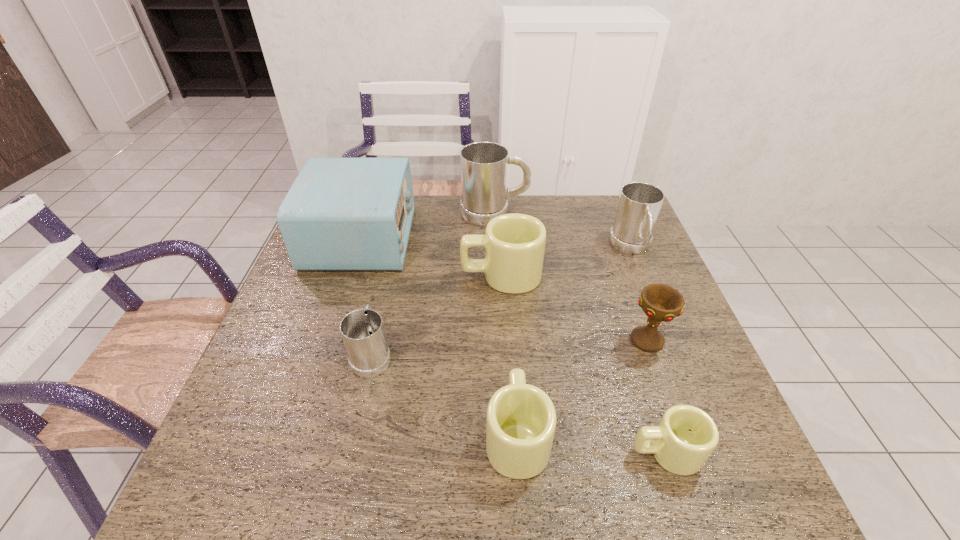
Where is `blank space that satisfies the following two spatial constraints: 1. with the handle on the side of the second biggest beige mug; 2. with the handle on the side of the farthest beige mug`? The height and width of the screenshot is (540, 960). blank space that satisfies the following two spatial constraints: 1. with the handle on the side of the second biggest beige mug; 2. with the handle on the side of the farthest beige mug is located at coordinates (506, 275).

The height and width of the screenshot is (540, 960). Identify the location of vacant point that satisfies the following two spatial constraints: 1. on the side of the rightmost gray mug with the handle; 2. with the handle on the side of the biggest beige mug. (643, 275).

Image resolution: width=960 pixels, height=540 pixels. Find the location of `vacant region that satisfies the following two spatial constraints: 1. on the front panel of the radio receiver; 2. on the side of the third nearest mug with the handle`. vacant region that satisfies the following two spatial constraints: 1. on the front panel of the radio receiver; 2. on the side of the third nearest mug with the handle is located at coordinates (323, 354).

Locate an element on the screen. vacant space that satisfies the following two spatial constraints: 1. on the front panel of the radio receiver; 2. with the handle on the side of the second smallest beige mug is located at coordinates (296, 435).